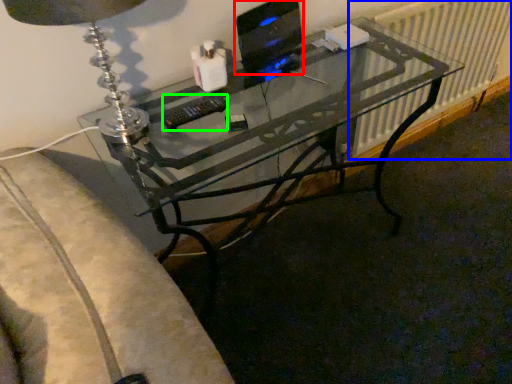
Question: Estimate the real-world distances between objects in this image. Which object is closer to computer monitor (highlighted by a red box), radiator (highlighted by a blue box) or control (highlighted by a green box)?

Choices:
 (A) radiator
 (B) control

Answer: (B)